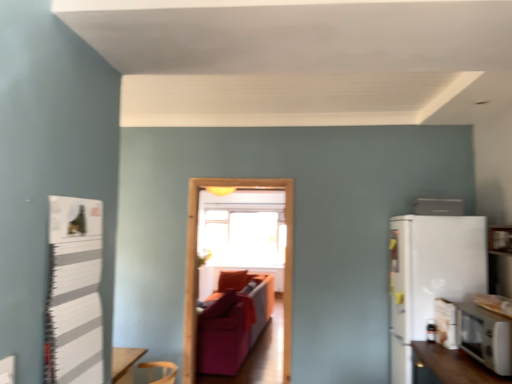
Question: From the image's perspective, is white striped bulletin board at left on velvet red couch at center?

Choices:
 (A) no
 (B) yes

Answer: (B)

Question: Is white striped bulletin board at left thinner than velvet red couch at center?

Choices:
 (A) yes
 (B) no

Answer: (A)

Question: Is white striped bulletin board at left aimed at velvet red couch at center?

Choices:
 (A) yes
 (B) no

Answer: (B)

Question: Considering the relative sizes of white striped bulletin board at left and velvet red couch at center in the image provided, is white striped bulletin board at left wider than velvet red couch at center?

Choices:
 (A) yes
 (B) no

Answer: (B)

Question: Is white striped bulletin board at left positioned beyond the bounds of velvet red couch at center?

Choices:
 (A) no
 (B) yes

Answer: (B)

Question: In terms of width, does white matte refrigerator at right look wider or thinner when compared to white striped bulletin board at left?

Choices:
 (A) wide
 (B) thin

Answer: (A)

Question: From their relative heights in the image, would you say white matte refrigerator at right is taller or shorter than white striped bulletin board at left?

Choices:
 (A) tall
 (B) short

Answer: (A)

Question: Based on their positions, is white matte refrigerator at right located to the left or right of white striped bulletin board at left?

Choices:
 (A) left
 (B) right

Answer: (B)

Question: Does point (414, 334) appear closer or farther from the camera than point (69, 198)?

Choices:
 (A) closer
 (B) farther

Answer: (B)

Question: Is white glossy refrigerator at upper right, placed as the second appliance when sorted from front to back, bigger or smaller than transparent glass window screen at center?

Choices:
 (A) big
 (B) small

Answer: (B)

Question: Considering the relative positions of white glossy refrigerator at upper right, the 2th appliance ordered from the bottom, and transparent glass window screen at center in the image provided, is white glossy refrigerator at upper right, the 2th appliance ordered from the bottom, to the left or to the right of transparent glass window screen at center?

Choices:
 (A) left
 (B) right

Answer: (B)

Question: Considering their positions, is white glossy refrigerator at upper right, the first appliance positioned from the top, located in front of or behind transparent glass window screen at center?

Choices:
 (A) behind
 (B) front

Answer: (B)

Question: Considering the positions of white glossy refrigerator at upper right, the 2th appliance ordered from the bottom, and transparent glass window screen at center in the image, is white glossy refrigerator at upper right, the 2th appliance ordered from the bottom, wider or thinner than transparent glass window screen at center?

Choices:
 (A) thin
 (B) wide

Answer: (B)

Question: Considering their positions, is white glossy microwave at lower right, acting as the 2th appliance starting from the back, located in front of or behind velvet red couch at center?

Choices:
 (A) front
 (B) behind

Answer: (A)

Question: From a real-world perspective, is white glossy microwave at lower right, the first appliance in the bottom-to-top sequence, physically located above or below velvet red couch at center?

Choices:
 (A) below
 (B) above

Answer: (B)